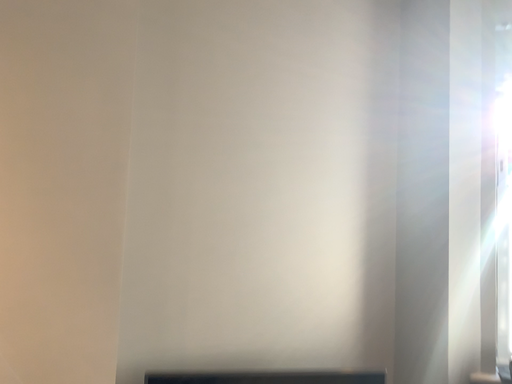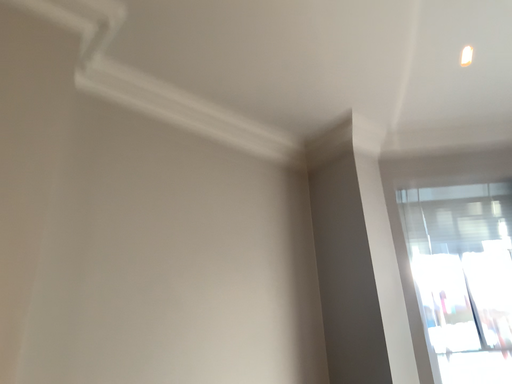
Question: How did the camera likely rotate when shooting the video?

Choices:
 (A) rotated downward
 (B) rotated upward

Answer: (B)